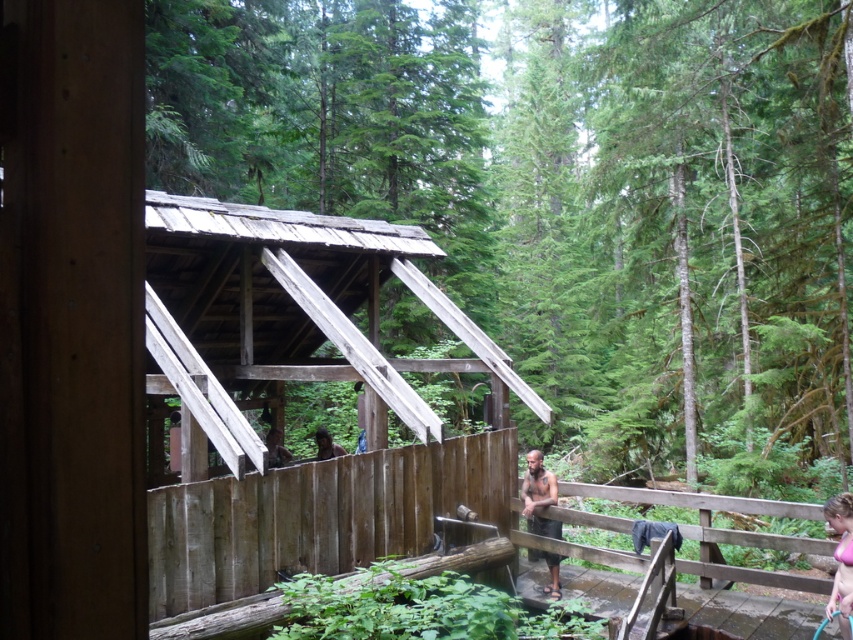
You are standing at the entrance of the rustic wooden structure and notice the brown wooden fence at lower right and the pink fabric at lower right. Which object is positioned to the left when viewed from your perspective?

The brown wooden fence at lower right is to the left of the pink fabric at lower right from your perspective.

You are standing in front of the rustic wooden structure in the forest and notice both the brown wooden fence at lower right and the pink fabric at lower right. Which object is closer to you?

The brown wooden fence at lower right is closer to you because it is further to the viewer than the pink fabric at lower right.

You are a hiker who just entered the rustic wooden structure in the forest. You notice two items inside. Where is the dark brown skin at center in relation to the pink fabric at lower right?

The dark brown skin at center is located to the left of the pink fabric at lower right.